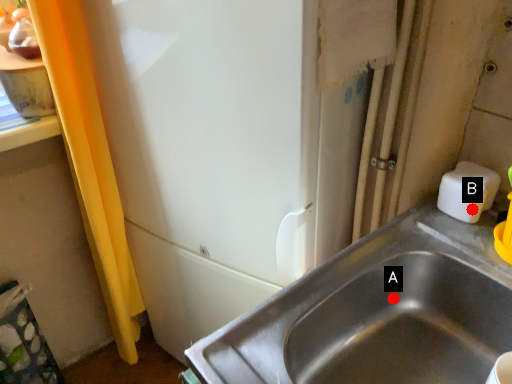
Question: Two points are circled on the image, labeled by A and B beside each circle. Which point is closer to the camera taking this photo?

Choices:
 (A) A is closer
 (B) B is closer

Answer: (B)